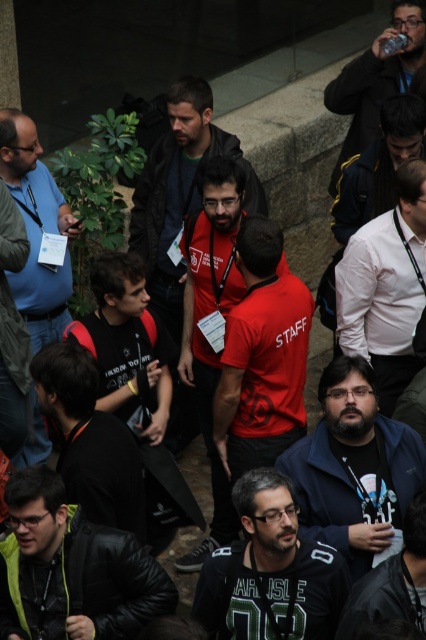
Question: Which object is positioned closest to the white shirt at center?

Choices:
 (A) matte blue shirt at left
 (B) dark blue jacket at center
 (C) clear plastic bottle at upper right
 (D) black matte jacket at center

Answer: (B)

Question: Which of the following is the farthest from the observer?

Choices:
 (A) dark gray jersey at center
 (B) red matte shirt at center
 (C) clear plastic bottle at upper right
 (D) dark blue jacket at center

Answer: (C)

Question: In this image, where is matte blue shirt at left located relative to dark gray fabric jacket at lower center?

Choices:
 (A) right
 (B) left

Answer: (B)

Question: Which is farther from the dark gray fabric jacket at lower center?

Choices:
 (A) matte red t-shirt at center
 (B) matte red shirt at center

Answer: (A)

Question: Does dark blue jacket at center appear on the right side of matte blue shirt at left?

Choices:
 (A) no
 (B) yes

Answer: (B)

Question: Considering the relative positions of red matte shirt at center and clear plastic bottle at upper right in the image provided, where is red matte shirt at center located with respect to clear plastic bottle at upper right?

Choices:
 (A) above
 (B) below

Answer: (B)